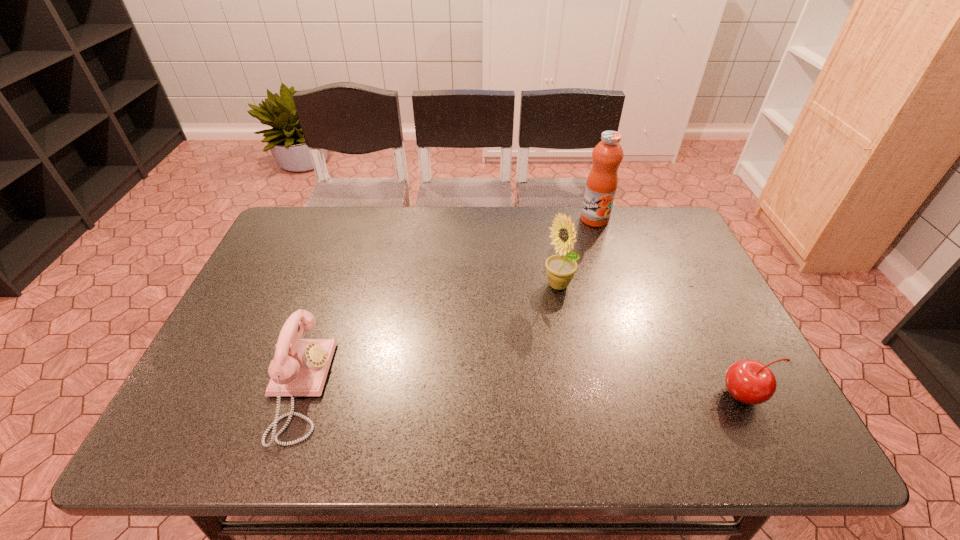
Where is `free space on the desktop that is between the third tallest object and the shortest object and is positioned on the face of the third nearest object`? free space on the desktop that is between the third tallest object and the shortest object and is positioned on the face of the third nearest object is located at coordinates (495, 391).

Locate an element on the screen. This screenshot has height=540, width=960. free space on the desktop that is between the leftmost object and the shortest object and is positioned on the front label of the fruit juice is located at coordinates (538, 392).